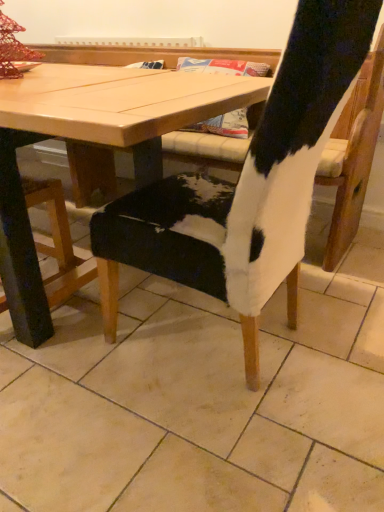
Image resolution: width=384 pixels, height=512 pixels. Identify the location of free region under cowhide chair at center (from a real-world perspective). (240, 362).